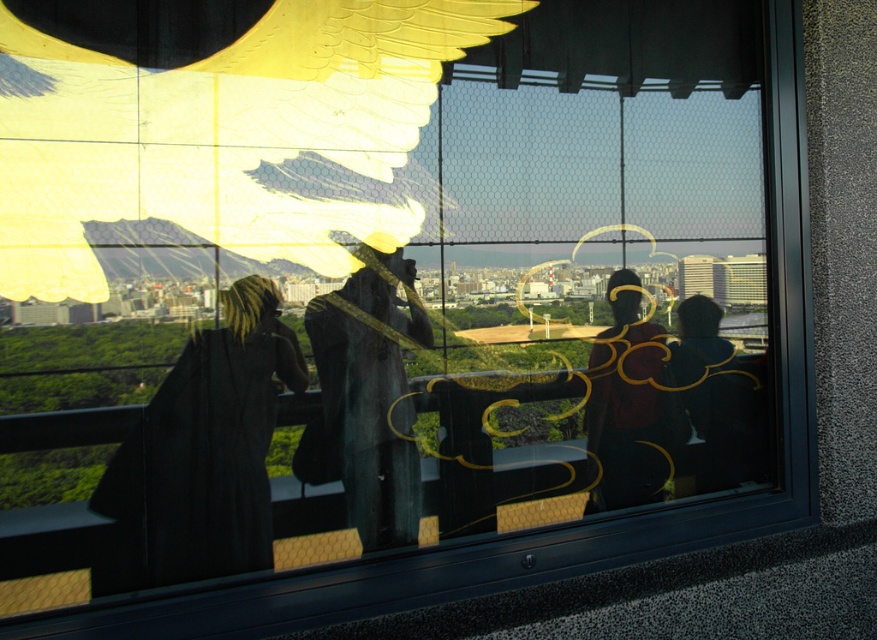
Is black matte coat at left above black matte jacket at right?

No.

What are the coordinates of `black matte coat at left` in the screenshot? It's located at (202, 452).

Based on the photo, who is more forward, [328,8] or [396,481]?

Point [328,8] is in front.

Does golden textured wings at upper center have a greater height compared to dark matte statue at center?

No.

Is point (412, 204) farther from camera compared to point (400, 317)?

Yes, point (412, 204) is behind point (400, 317).

Identify the location of golden textured wings at upper center. (222, 134).

Who is more distant from viewer, (325, 204) or (202, 336)?

The point (325, 204) is behind.

Is golden textured wings at upper center taller than black matte coat at left?

In fact, golden textured wings at upper center may be shorter than black matte coat at left.

Is point (107, 67) farther from viewer compared to point (189, 570)?

Yes, it is.

Locate an element on the screen. golden textured wings at upper center is located at coordinates (222, 134).